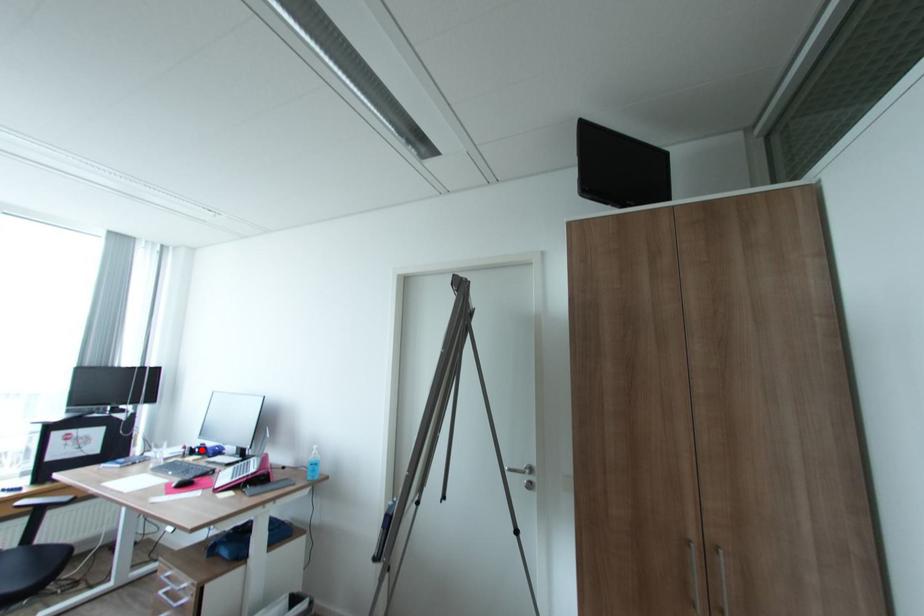
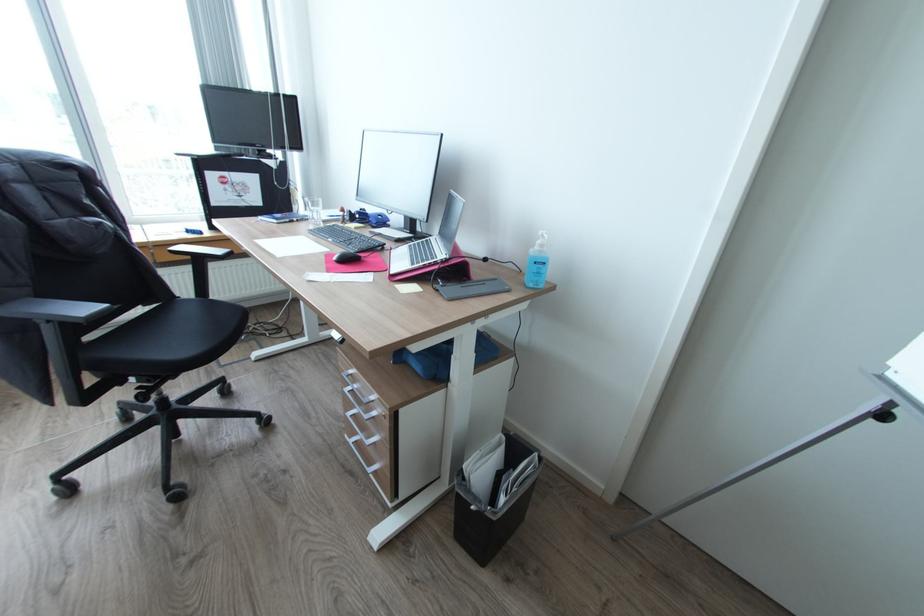
Find the pixel in the second image that matches the highlighted location in the first image.

(362, 216)